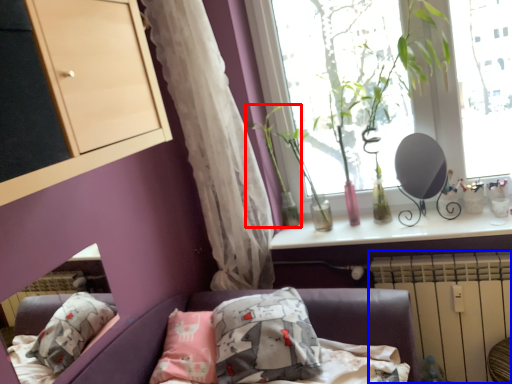
Question: Among these objects, which one is nearest to the camera, plant (highlighted by a red box) or radiator (highlighted by a blue box)?

Choices:
 (A) plant
 (B) radiator

Answer: (B)